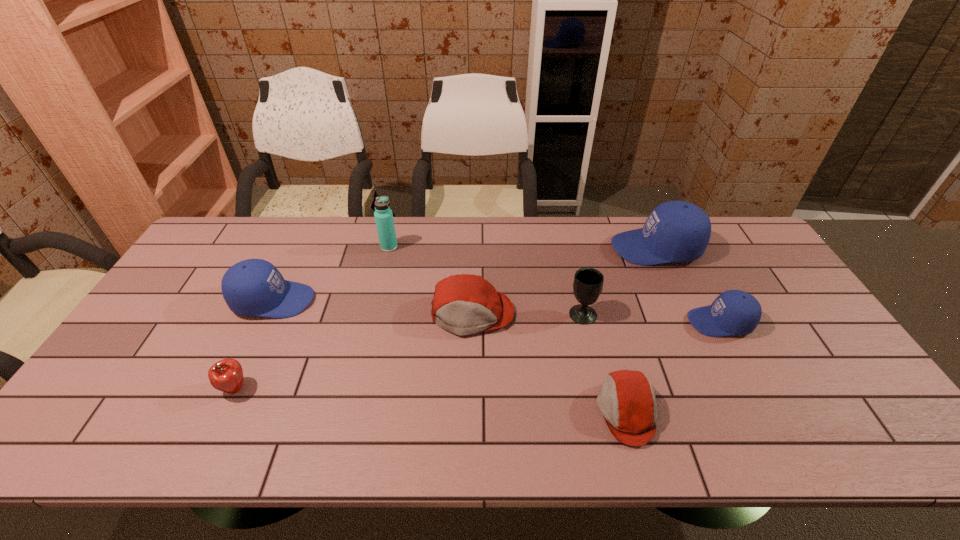
Locate an element on the screen. free space located on the front-facing side of the smallest blue cap is located at coordinates (624, 322).

Find the location of a particular element. Image resolution: width=960 pixels, height=540 pixels. free space located on the front-facing side of the smallest blue cap is located at coordinates (592, 322).

The width and height of the screenshot is (960, 540). Identify the location of blank space located on the front-facing side of the smallest blue cap. (627, 322).

Where is `vacant space located 0.230m on the right of the apple`? Image resolution: width=960 pixels, height=540 pixels. vacant space located 0.230m on the right of the apple is located at coordinates (344, 389).

The width and height of the screenshot is (960, 540). Find the location of `vacant space located 0.150m on the front-facing side of the right red cap`. vacant space located 0.150m on the front-facing side of the right red cap is located at coordinates (x=534, y=411).

Image resolution: width=960 pixels, height=540 pixels. In order to click on vacant space located on the front-facing side of the right red cap in this screenshot , I will do `click(520, 411)`.

Where is `free space located on the front-facing side of the right red cap`? Image resolution: width=960 pixels, height=540 pixels. free space located on the front-facing side of the right red cap is located at coordinates (513, 411).

This screenshot has height=540, width=960. I want to click on thermos bottle that is at the far edge, so click(383, 214).

The height and width of the screenshot is (540, 960). I want to click on cap at the far edge, so click(x=675, y=231).

You are a GUI agent. You are given a task and a screenshot of the screen. Output one action in this format:
    pyautogui.click(x=<x>, y=<y>)
    Task: Click on the object that is at the near edge
    The image size is (960, 540).
    Given the screenshot: What is the action you would take?
    pyautogui.click(x=627, y=402)